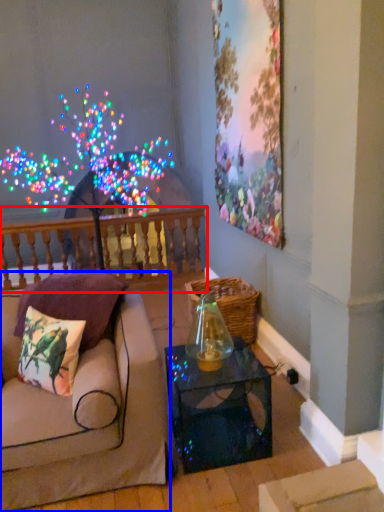
Question: Which object is further to the camera taking this photo, balustrade (highlighted by a red box) or studio couch (highlighted by a blue box)?

Choices:
 (A) balustrade
 (B) studio couch

Answer: (A)